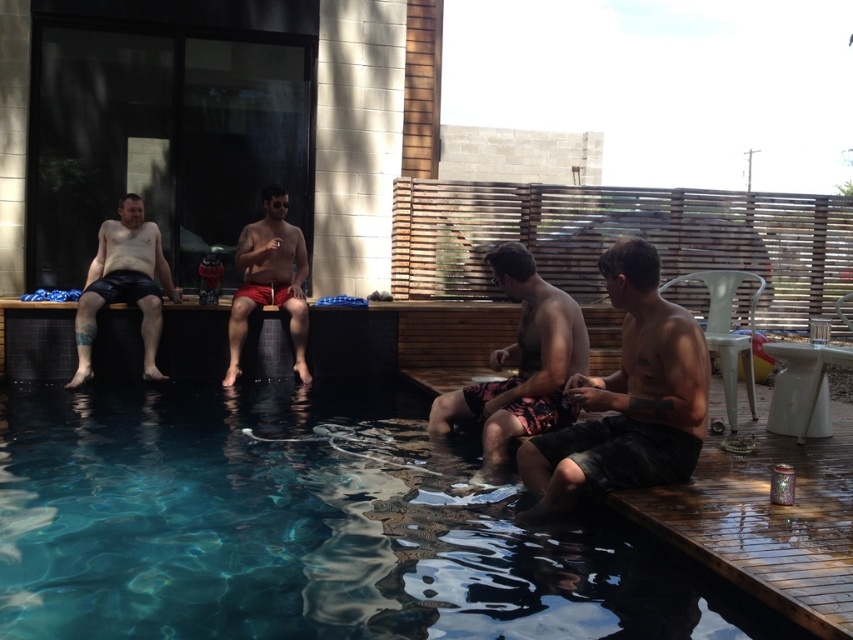
Is leather shorts at left bigger than matte red shorts at center?

Incorrect, leather shorts at left is not larger than matte red shorts at center.

Is leather shorts at left positioned at the back of matte red shorts at center?

No, it is in front of matte red shorts at center.

Image resolution: width=853 pixels, height=640 pixels. Identify the location of leather shorts at left. (125, 284).

Is point (451, 424) farther from viewer compared to point (138, 205)?

No, it is not.

Does point (531, 417) lie in front of point (135, 236)?

Yes, it is.

I want to click on camouflage shorts at center, so click(521, 364).

Which of these two, dark gray shorts at center or camouflage shorts at center, stands shorter?

With less height is camouflage shorts at center.

Between point (694, 436) and point (447, 396), which one is positioned in front?

Point (694, 436) is more forward.

Locate an element on the screen. This screenshot has height=640, width=853. dark gray shorts at center is located at coordinates (627, 397).